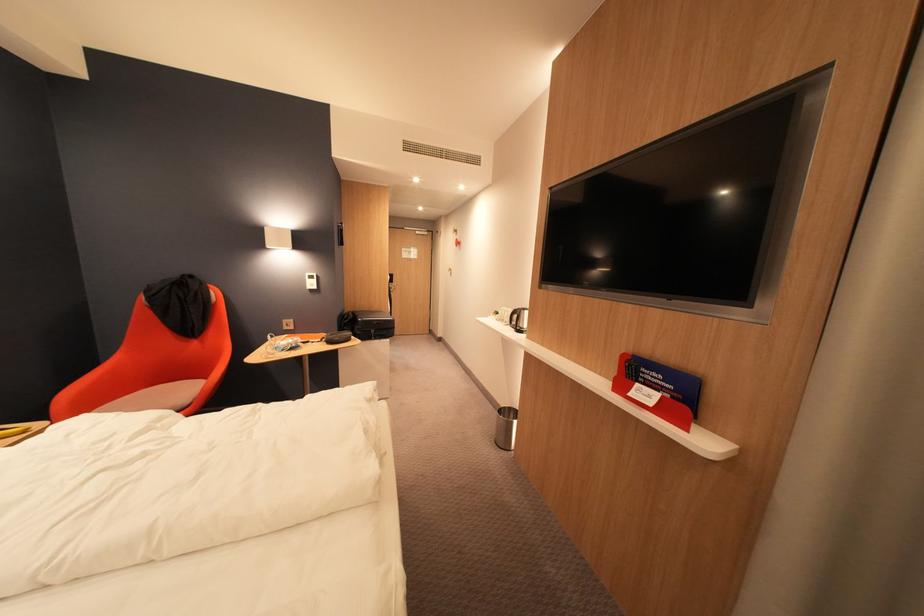
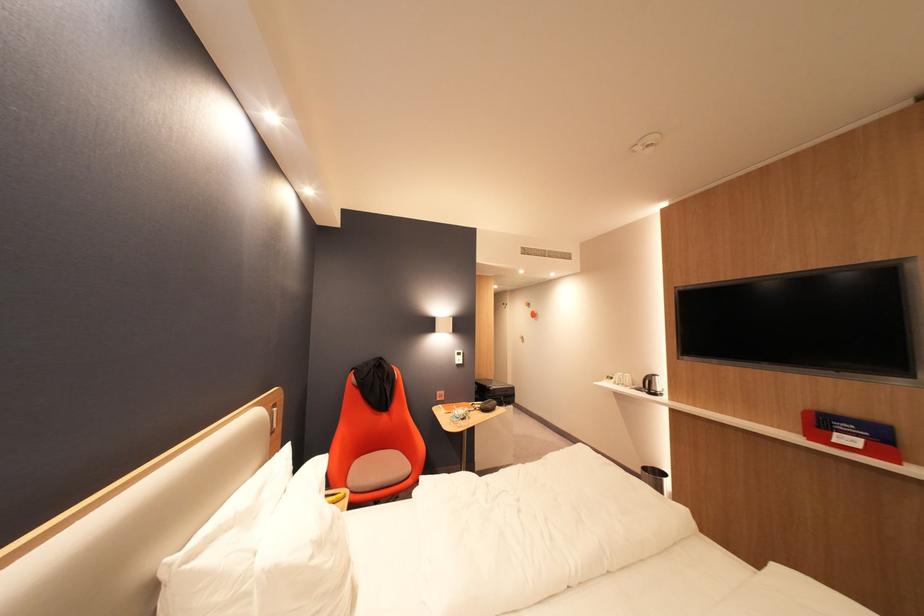
The point at [506,315] is marked in the first image. Where is the corresponding point in the second image?

(622, 379)